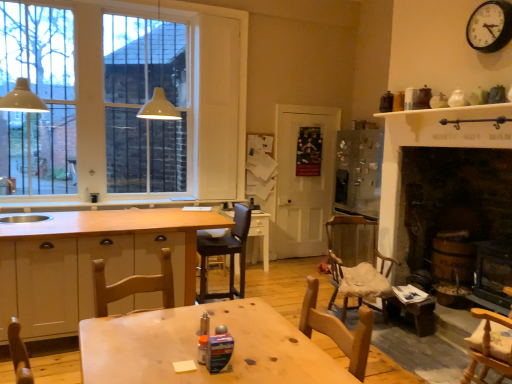
Question: From the image's perspective, relative to wooden chair at lower center, the second chair when ordered from left to right, is white wood cabinetry at center above or below?

Choices:
 (A) above
 (B) below

Answer: (B)

Question: In terms of width, does white wood cabinetry at center look wider or thinner when compared to wooden chair at lower center, the second chair when ordered from left to right?

Choices:
 (A) thin
 (B) wide

Answer: (B)

Question: Considering the real-world distances, which object is farthest from the matte white lampshade at left, placed as the 2th light fixture when sorted from right to left?

Choices:
 (A) wooden chair at lower center, the second chair when ordered from left to right
 (B) wooden chair with cushion at center-right, placed as the 4th chair when sorted from front to back
 (C) leatherette bar stool at center, arranged as the 1th chair when viewed from the left
 (D) wooden at left
 (E) white glossy table at center, the 2th table in the front-to-back sequence

Answer: (B)

Question: Based on their relative distances, which object is farther from the wooden chair at lower center, which ranks as the 4th chair in back-to-front order?

Choices:
 (A) white matte door at center
 (B) matte white lampshade at left, acting as the 1th light fixture starting from the left
 (C) wooden table at center, which is the 1th table in front-to-back order
 (D) white glossy table at center, the 2th table in the front-to-back sequence
 (E) white glass window at upper left

Answer: (E)